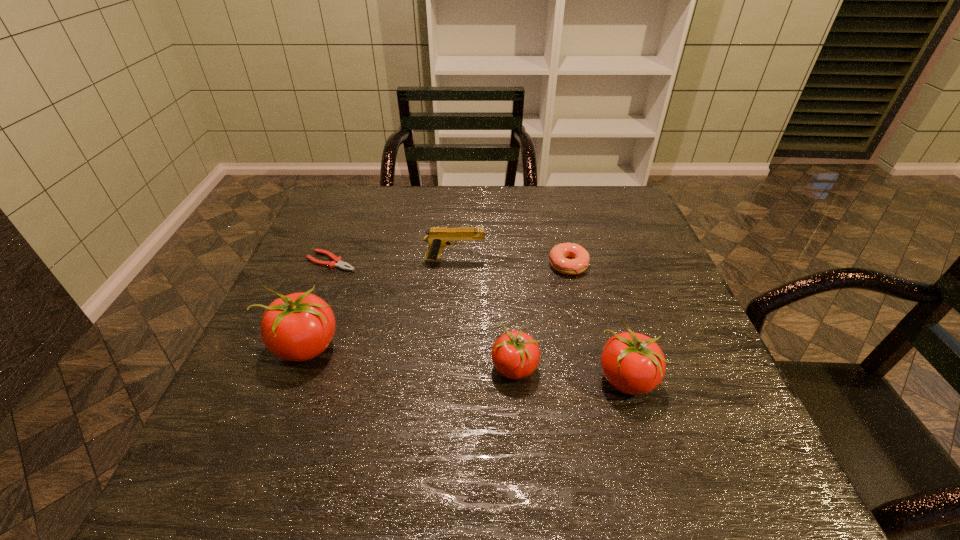
This screenshot has height=540, width=960. Identify the location of the tallest tomato. (298, 327).

You are a GUI agent. You are given a task and a screenshot of the screen. Output one action in this format:
    pyautogui.click(x=<x>, y=<y>)
    Task: Click on the leftmost tomato
    
    Given the screenshot: What is the action you would take?
    pyautogui.click(x=298, y=327)

Where is `the fourth object from left to right`? the fourth object from left to right is located at coordinates pos(515,354).

Identify the location of the second tomato from left to right. This screenshot has height=540, width=960. (515, 354).

Locate an element on the screen. This screenshot has width=960, height=540. the rightmost tomato is located at coordinates (633, 363).

Where is `pliers`? pliers is located at coordinates (337, 261).

Identify the location of doughnut. (558, 255).

At what (x,y) coordinates should I click in order to perform the action: click on the fourth object from right to left. Please return your answer as a coordinate pair (x, y). This screenshot has width=960, height=540. Looking at the image, I should click on [x=438, y=238].

Identify the location of vacant space located 0.090m on the back of the tallest tomato. The height and width of the screenshot is (540, 960). (326, 295).

The image size is (960, 540). In order to click on vacant space located 0.290m on the right of the fourth object from left to right in this screenshot , I will do `click(683, 368)`.